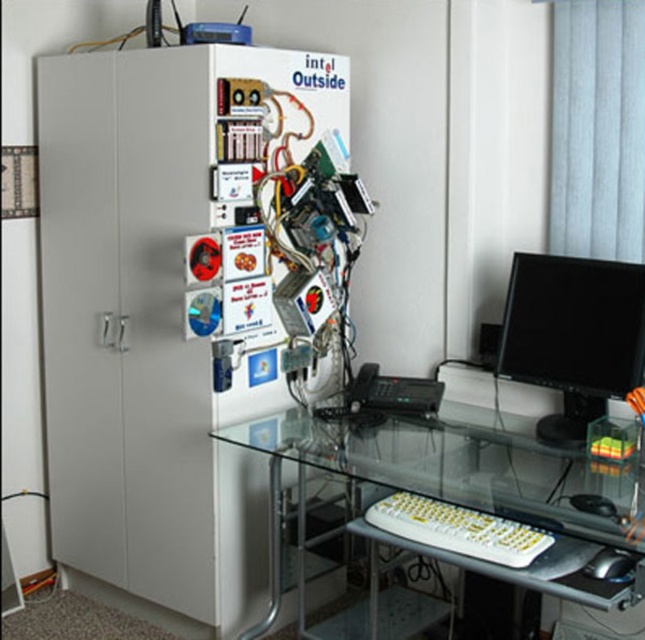
Who is more distant from viewer, [511,262] or [424,531]?

Positioned behind is point [511,262].

In order to click on black glossy monitor at right in this screenshot , I will do `click(573, 336)`.

This screenshot has height=640, width=645. I want to click on black glossy monitor at right, so [x=573, y=336].

Is white matte refrigerator at left to the right of transparent glass computer desk at lower center from the viewer's perspective?

No, white matte refrigerator at left is not to the right of transparent glass computer desk at lower center.

Does white matte refrigerator at left have a lesser width compared to transparent glass computer desk at lower center?

Yes, white matte refrigerator at left is thinner than transparent glass computer desk at lower center.

The image size is (645, 640). In order to click on white matte refrigerator at left in this screenshot , I will do `click(166, 307)`.

Where is `white matte refrigerator at left`? white matte refrigerator at left is located at coordinates (166, 307).

Which is behind, point (372, 480) or point (441, 513)?

Point (441, 513)

Is point (506, 435) behind point (530, 540)?

Yes.

Is point (491, 570) positioned behind point (415, 508)?

That is False.

This screenshot has height=640, width=645. Identify the location of transparent glass computer desk at lower center. (461, 468).